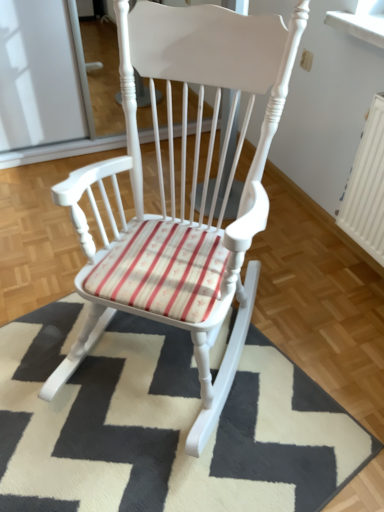
The width and height of the screenshot is (384, 512). Identify the location of vacant space underneath white wood rocking chair at center (from a real-world perspective). (170, 353).